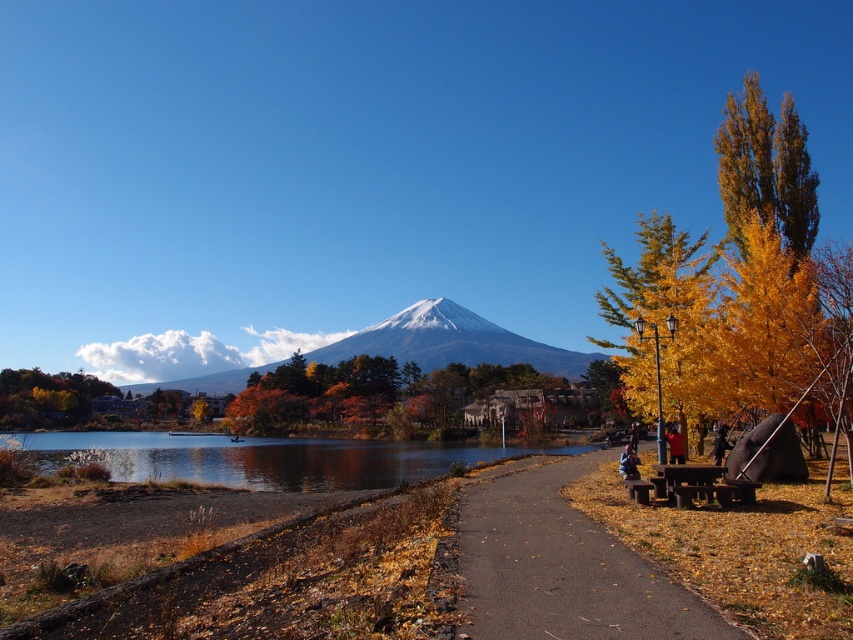
You are standing on the pathway and want to take a photo of the golden leafy tree at lower left and the clear water at lower left. Which object should you focus on first to ensure both are in the frame?

You should focus on the golden leafy tree at lower left first because the clear water at lower left is in front of it, so adjusting the camera to include the closer water first will naturally include the tree in the background.